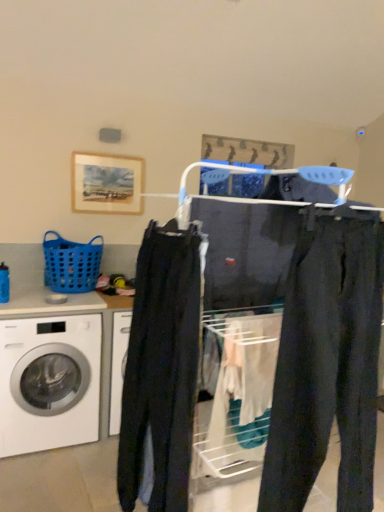
Question: Does blue plastic basket at left contain dark blue jeans at center?

Choices:
 (A) no
 (B) yes

Answer: (A)

Question: Is blue plastic basket at left bigger than dark blue jeans at center?

Choices:
 (A) no
 (B) yes

Answer: (A)

Question: Considering the relative positions of blue plastic basket at left and dark blue jeans at center in the image provided, is blue plastic basket at left to the left of dark blue jeans at center from the viewer's perspective?

Choices:
 (A) no
 (B) yes

Answer: (B)

Question: From the image's perspective, is blue plastic basket at left above dark blue jeans at center?

Choices:
 (A) no
 (B) yes

Answer: (B)

Question: Does blue plastic basket at left have a lesser width compared to dark blue jeans at center?

Choices:
 (A) no
 (B) yes

Answer: (B)

Question: Relative to wooden frame at upper left, is dark blue jeans at center in front or behind?

Choices:
 (A) front
 (B) behind

Answer: (A)

Question: Is dark blue jeans at center taller or shorter than wooden frame at upper left?

Choices:
 (A) short
 (B) tall

Answer: (B)

Question: Is dark blue jeans at center bigger or smaller than wooden frame at upper left?

Choices:
 (A) big
 (B) small

Answer: (A)

Question: Visually, is dark blue jeans at center positioned to the left or to the right of wooden frame at upper left?

Choices:
 (A) left
 (B) right

Answer: (B)

Question: From their relative heights in the image, would you say blue plastic basket at left is taller or shorter than wooden frame at upper left?

Choices:
 (A) tall
 (B) short

Answer: (B)

Question: Does point (84, 279) appear closer or farther from the camera than point (82, 156)?

Choices:
 (A) farther
 (B) closer

Answer: (B)

Question: From a real-world perspective, relative to wooden frame at upper left, is blue plastic basket at left vertically above or below?

Choices:
 (A) above
 (B) below

Answer: (B)

Question: Based on their positions, is blue plastic basket at left located to the left or right of wooden frame at upper left?

Choices:
 (A) left
 (B) right

Answer: (A)

Question: Considering their positions, is white glossy washing machine at lower left located in front of or behind dark gray cotton pants at center?

Choices:
 (A) front
 (B) behind

Answer: (B)

Question: Is white glossy washing machine at lower left inside the boundaries of dark gray cotton pants at center, or outside?

Choices:
 (A) inside
 (B) outside

Answer: (B)